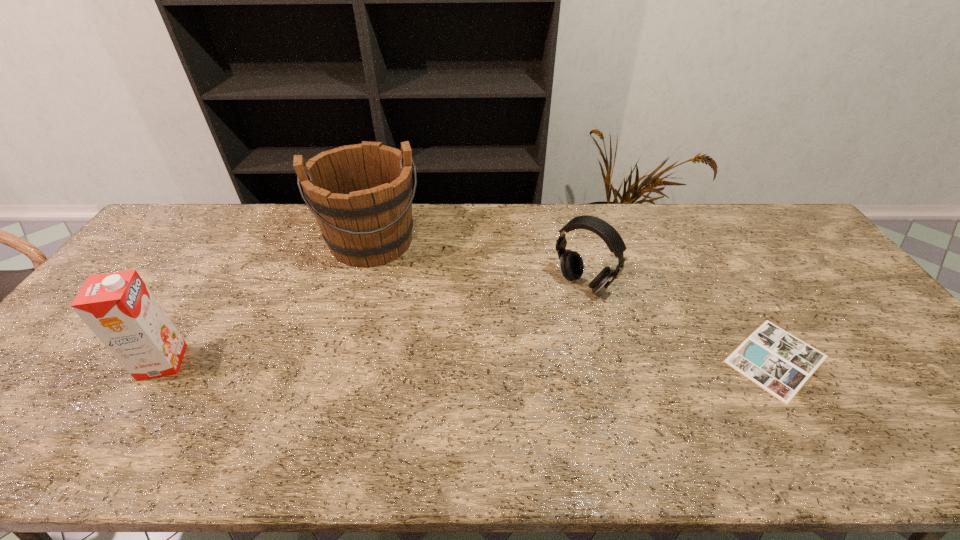
This screenshot has height=540, width=960. What are the coordinates of `free space located on the ear cups of the second object from right to left` in the screenshot? It's located at [x=529, y=339].

Image resolution: width=960 pixels, height=540 pixels. What are the coordinates of `blank space located on the side of the wine bucket with the handle for carrying` in the screenshot? It's located at (398, 380).

Find the location of a particular element. This screenshot has height=540, width=960. free point located on the side of the wine bucket with the handle for carrying is located at coordinates (396, 364).

You are a GUI agent. You are given a task and a screenshot of the screen. Output one action in this format:
    pyautogui.click(x=<x>, y=<y>)
    Task: Click on the blank space located on the side of the wine bucket with the handle for carrying
    
    Given the screenshot: What is the action you would take?
    pyautogui.click(x=390, y=331)

Where is `object present at the far edge`? The height and width of the screenshot is (540, 960). object present at the far edge is located at coordinates (361, 195).

This screenshot has width=960, height=540. Identify the location of object at the near edge. (780, 363).

Identify the location of vacant space at the far edge of the desktop. This screenshot has height=540, width=960. point(276,228).

You are a GUI agent. You are given a task and a screenshot of the screen. Output one action in this format:
    pyautogui.click(x=<x>, y=<y>)
    Task: Click on the blank space at the near edge
    This screenshot has width=960, height=540.
    Given the screenshot: What is the action you would take?
    pyautogui.click(x=816, y=394)

Find the location of a particular element. This screenshot has width=960, height=540. vacant region at the right edge of the desktop is located at coordinates 888,355.

What are the coordinates of `free space at the far right corner of the desktop` in the screenshot? It's located at (767, 204).